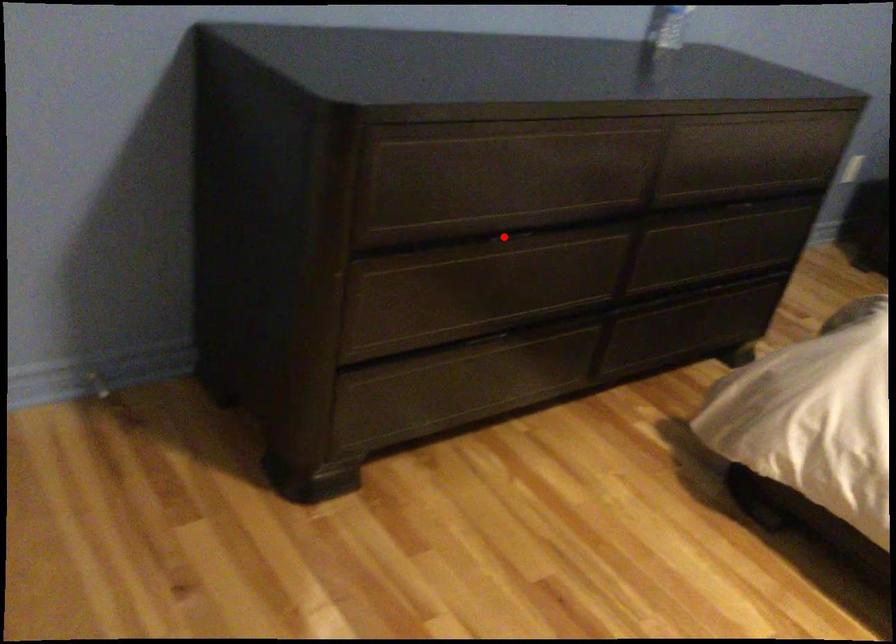
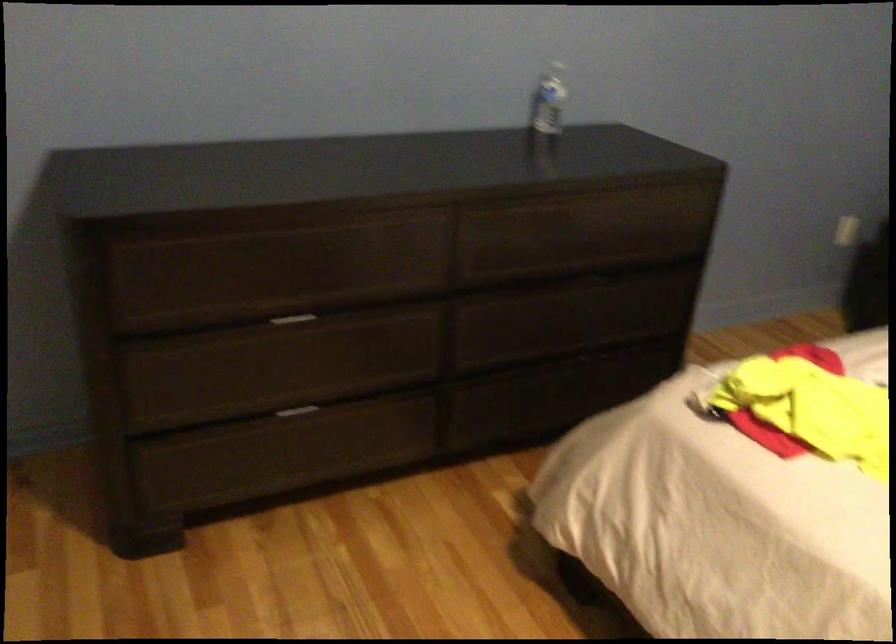
Question: I am providing you with two images of the same scene from different viewpoints. Given a red point in image1, look at the same physical point in image2. Is it:

Choices:
 (A) Closer to the viewpoint
 (B) Farther from the viewpoint

Answer: (B)